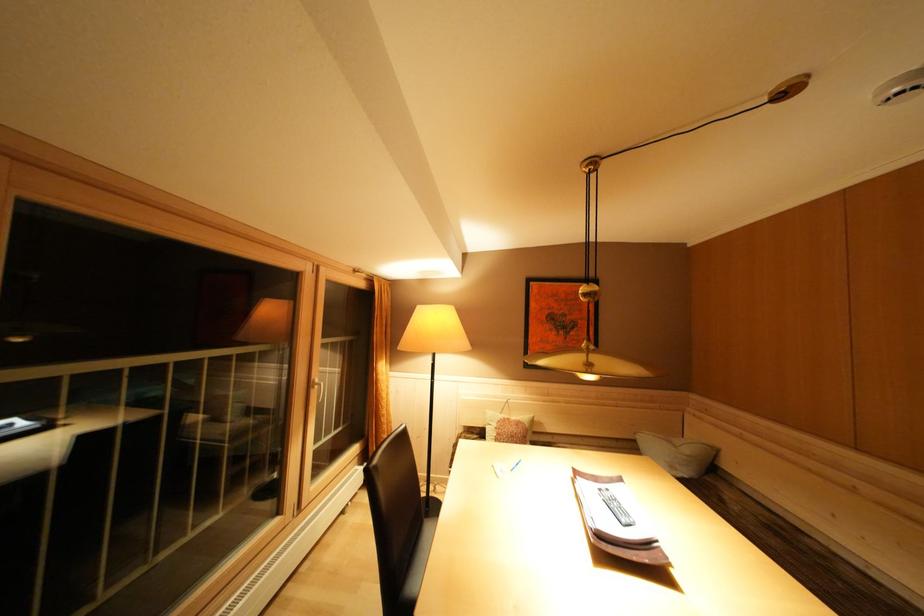
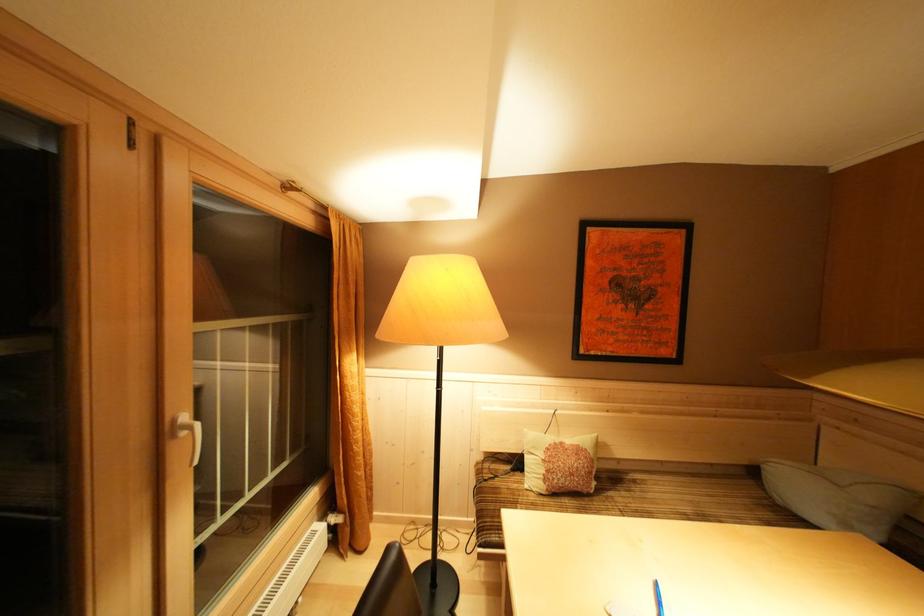
Locate, in the second image, the point that corresponds to (322,392) in the first image.

(190, 438)